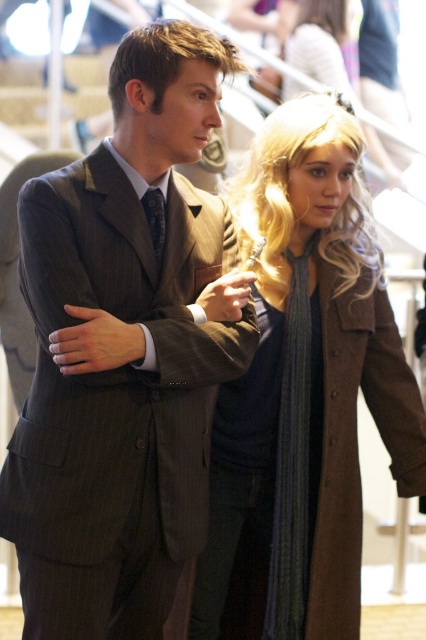
Question: Is pinstriped wool suit at center thinner than brown wool coat at center?

Choices:
 (A) yes
 (B) no

Answer: (A)

Question: Does pinstriped wool suit at center have a smaller size compared to brown wool coat at center?

Choices:
 (A) yes
 (B) no

Answer: (B)

Question: Which point is closer to the camera?

Choices:
 (A) (201, 412)
 (B) (310, 408)

Answer: (A)

Question: Which point is farther to the camera?

Choices:
 (A) coord(124,588)
 (B) coord(317,604)

Answer: (B)

Question: Can you confirm if pinstriped wool suit at center is positioned to the left of brown wool coat at center?

Choices:
 (A) no
 (B) yes

Answer: (B)